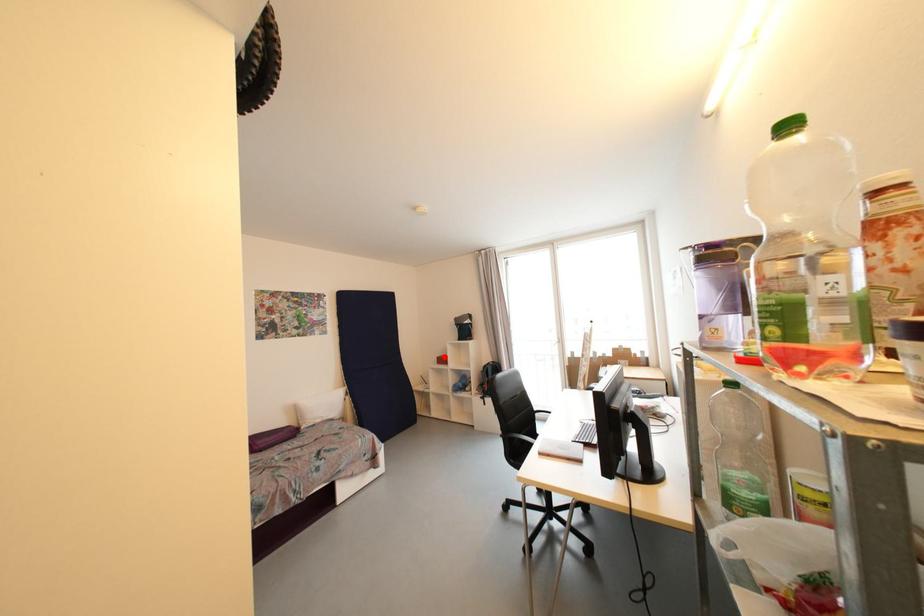
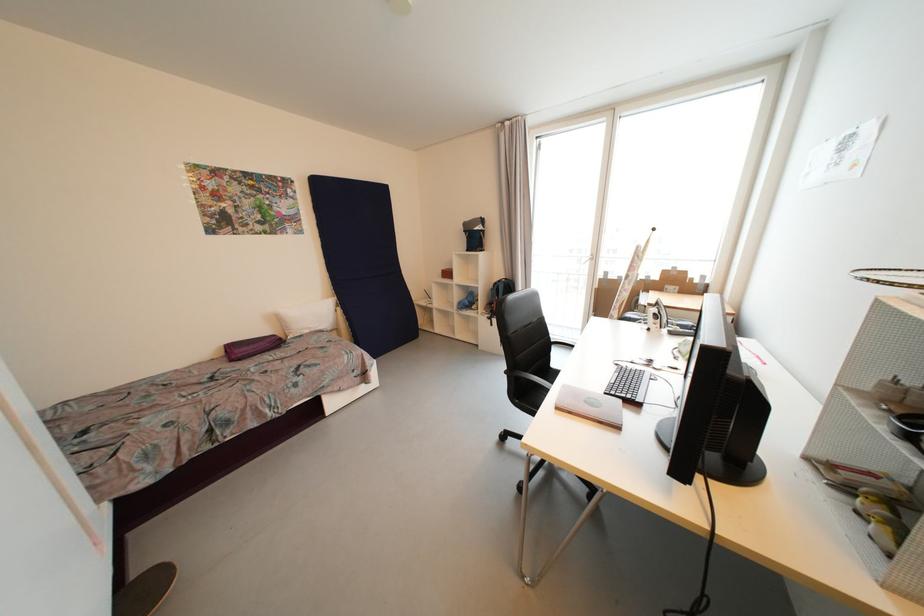
Question: I am providing you with two images of the same scene from different viewpoints. Image1 has a red point marked. In image2, the corresponding 3D location appears at what relative position? Reply with the corresponding letter.

Choices:
 (A) Closer
 (B) Farther

Answer: (A)